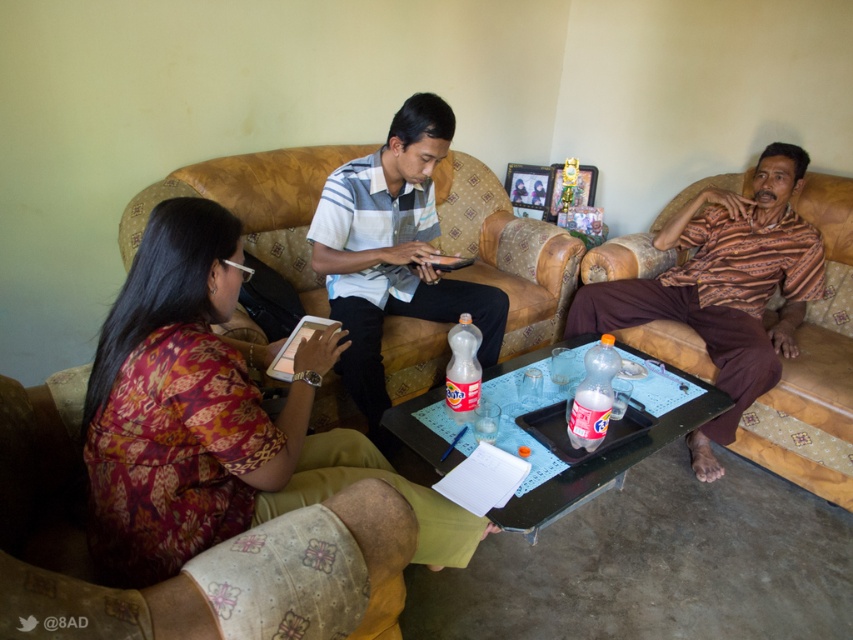
You are a furniture designer analyzing the seating arrangement. Based on the scene, which object is taller between the leather couch at center and the striped cotton shirt at center?

The striped cotton shirt at center is taller than the leather couch at center according to the description.

You are standing in the room and want to place a new plant on the coffee table. Which object, the leather couch at center or the sofa where the woman is sitting, is closer to the coffee table?

The leather couch at center is closer to the coffee table because it is located at point (x=506, y=252), which is closer to the coffee table than the sofa where the woman is sitting.

Based on the scene description, where is the leather couch at center located in terms of coordinates?

The leather couch at center is located at coordinates point (506, 252).